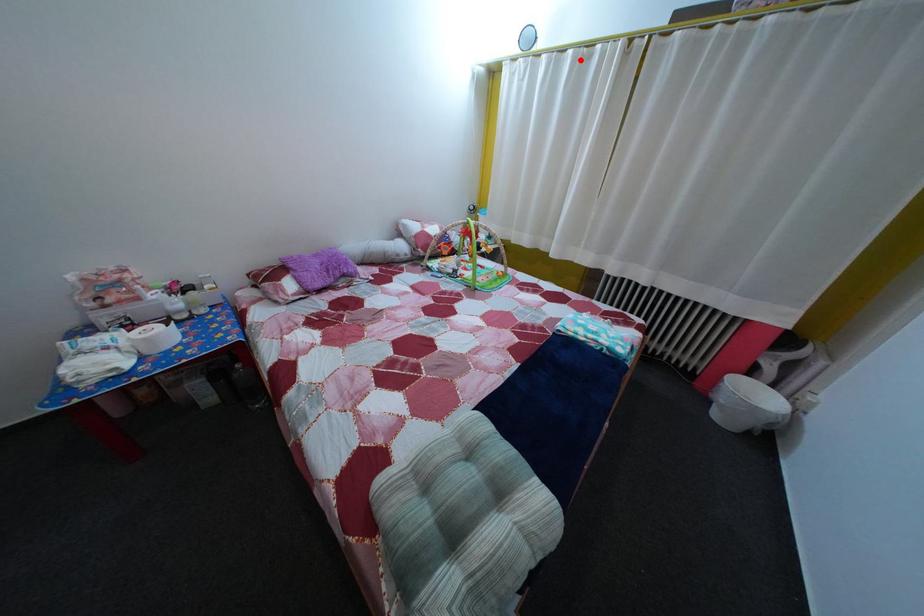
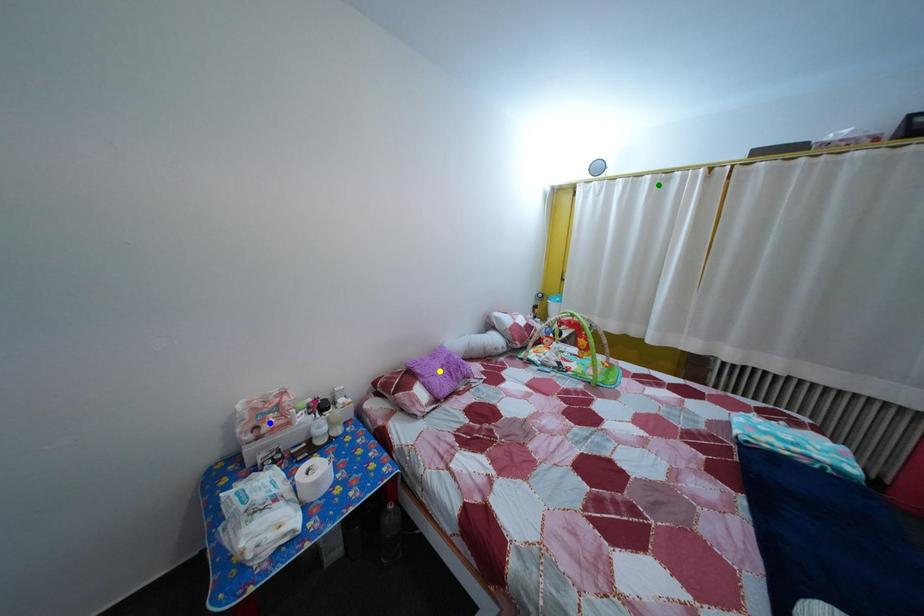
Question: I am providing you with two images of the same scene from different viewpoints. A red point is marked on the first image. You are given multiple points on the second image. Which point in image 2 represents the same 3d spot as the red point in image 1?

Choices:
 (A) blue point
 (B) yellow point
 (C) green point

Answer: (C)